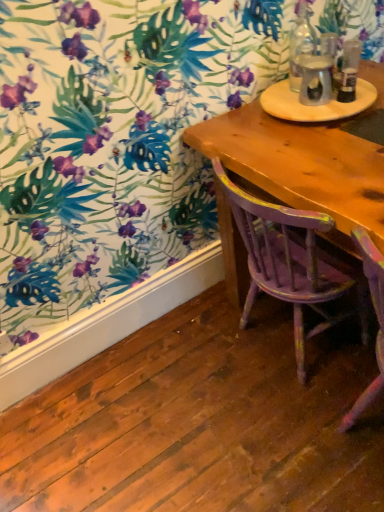
Identify the location of free location to the left of clear glass bottle at upper right, which ranks as the 1th bottle in right-to-left order. (292, 109).